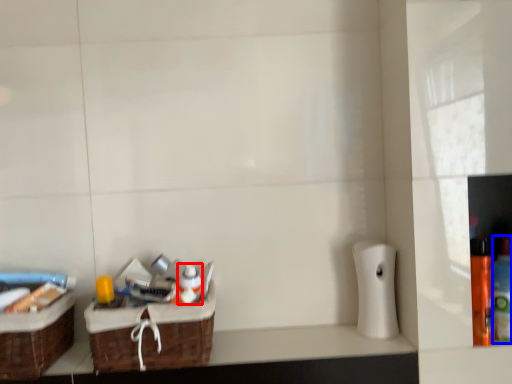
Question: Which object is closer to the camera taking this photo, mouthwash (highlighted by a red box) or bottle (highlighted by a blue box)?

Choices:
 (A) mouthwash
 (B) bottle

Answer: (B)